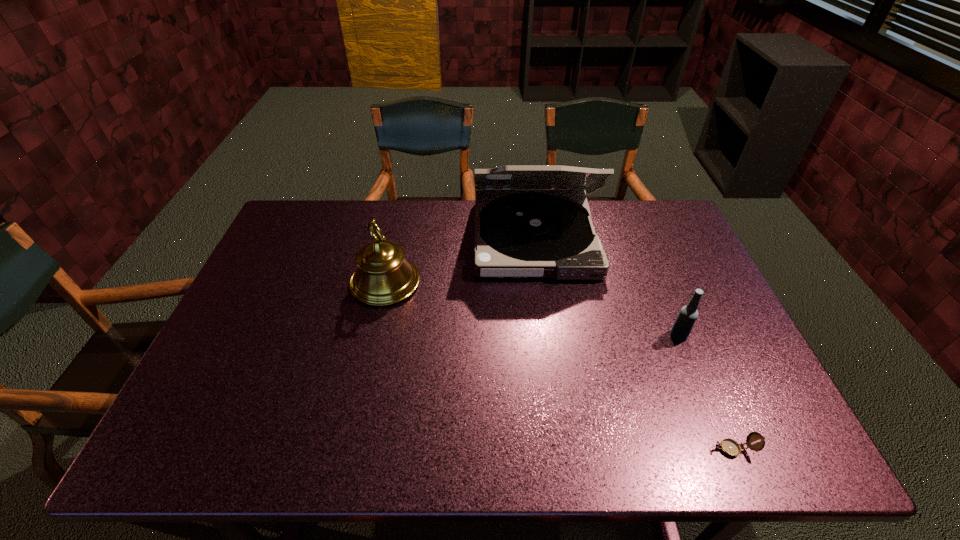
You are a GUI agent. You are given a task and a screenshot of the screen. Output one action in this format:
    pyautogui.click(x=<x>, y=<y>)
    Task: Click on the vacant area that lies between the third tallest object and the CD player
    Image resolution: width=960 pixels, height=540 pixels.
    Given the screenshot: What is the action you would take?
    pyautogui.click(x=607, y=287)

Identify the location of free space between the CD player and the shortest object. This screenshot has width=960, height=540. (634, 343).

The height and width of the screenshot is (540, 960). Identify the location of free spot between the leftmost object and the tallest object. (460, 260).

You are a GUI agent. You are given a task and a screenshot of the screen. Output one action in this format:
    pyautogui.click(x=<x>, y=<y>)
    Task: Click on the free spot between the CD player and the shortest object
    This screenshot has height=540, width=960.
    Given the screenshot: What is the action you would take?
    pyautogui.click(x=634, y=343)

Identify which object is located as the nearest to the third farthest object. Please provide its 2D coordinates. Your answer should be formatted as a tuple, i.e. [(x, y)], where the tuple contains the x and y coordinates of a point satisfying the conditions above.

[(526, 231)]

Locate which object ranks in proximity to the second tallest object. Please provide its 2D coordinates. Your answer should be formatted as a tuple, i.e. [(x, y)], where the tuple contains the x and y coordinates of a point satisfying the conditions above.

[(526, 231)]

Locate an element on the screen. Image resolution: width=960 pixels, height=540 pixels. free spot that satisfies the following two spatial constraints: 1. on the front side of the leftmost object; 2. on the right side of the bottle is located at coordinates (374, 335).

This screenshot has height=540, width=960. I want to click on free spot that satisfies the following two spatial constraints: 1. on the control panel of the third tallest object; 2. on the right side of the tallest object, so click(x=548, y=335).

The width and height of the screenshot is (960, 540). I want to click on free point that satisfies the following two spatial constraints: 1. on the control panel of the second shortest object; 2. on the right side of the CD player, so click(x=548, y=335).